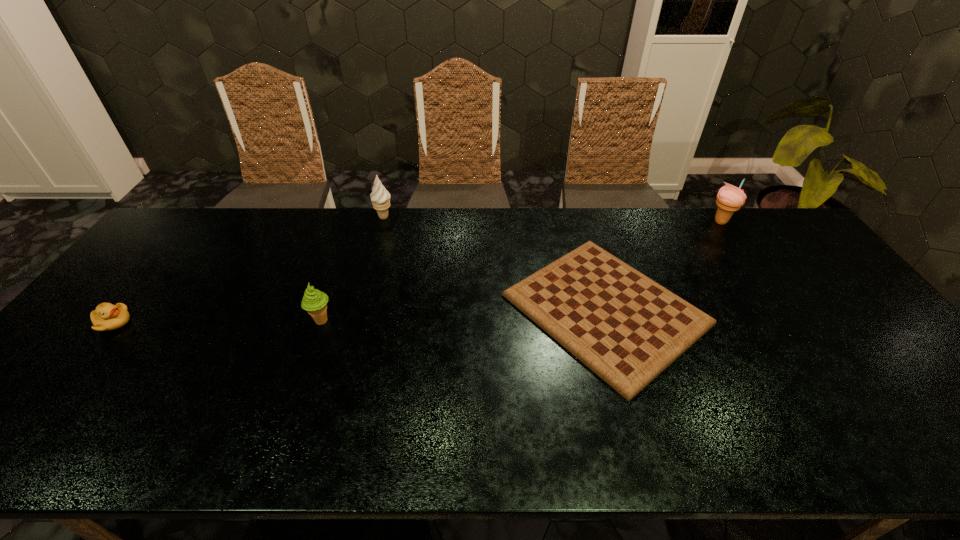
Locate an element on the screen. Image resolution: width=960 pixels, height=540 pixels. the second icecream from left to right is located at coordinates (380, 197).

Find the location of `the rightmost object`. the rightmost object is located at coordinates (729, 198).

Where is `the leftmost icecream`? This screenshot has width=960, height=540. the leftmost icecream is located at coordinates (314, 301).

Identify the location of the nearest icecream. This screenshot has width=960, height=540. (314, 301).

Locate an element on the screen. duckling is located at coordinates (106, 317).

Identify the location of the second shortest object. The image size is (960, 540). (106, 317).

Where is `gameboard`? gameboard is located at coordinates (625, 327).

Locate an element on the screen. The image size is (960, 540). the shortest object is located at coordinates (625, 327).

This screenshot has height=540, width=960. What are the coordinates of `vacant space located 0.090m on the front-facing side of the third object from right to left` in the screenshot? It's located at (420, 217).

Locate an element on the screen. This screenshot has height=540, width=960. vacant space situated 0.380m on the front of the rightmost icecream is located at coordinates (781, 312).